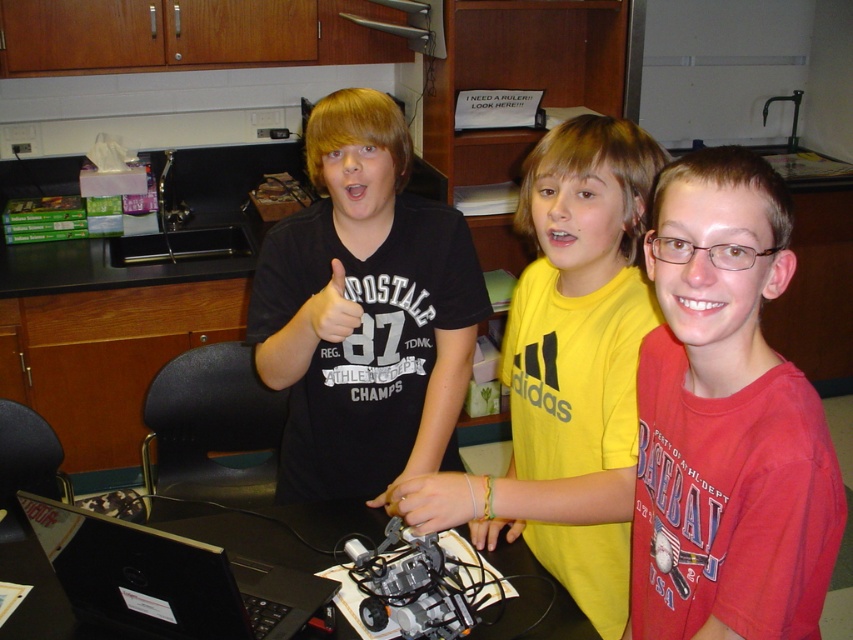
In the scene shown: You are a photographer trying to position a camera at point 0.5, 0.5 to capture the black matte shirt at center. Is the shirt within the camera frame centered at 0.5, 0.5 with a radius of 0.1?

The black matte shirt at center is located at point (366, 310). The distance from the center point (426, 320) to the shirt is sqrt